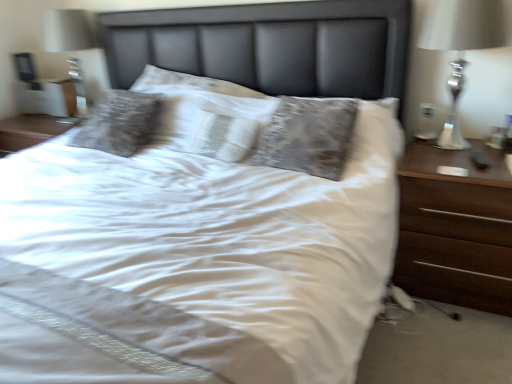
Locate an element on the screen. The width and height of the screenshot is (512, 384). vacant region below silver metallic lamp at right (from a real-world perspective) is located at coordinates (461, 150).